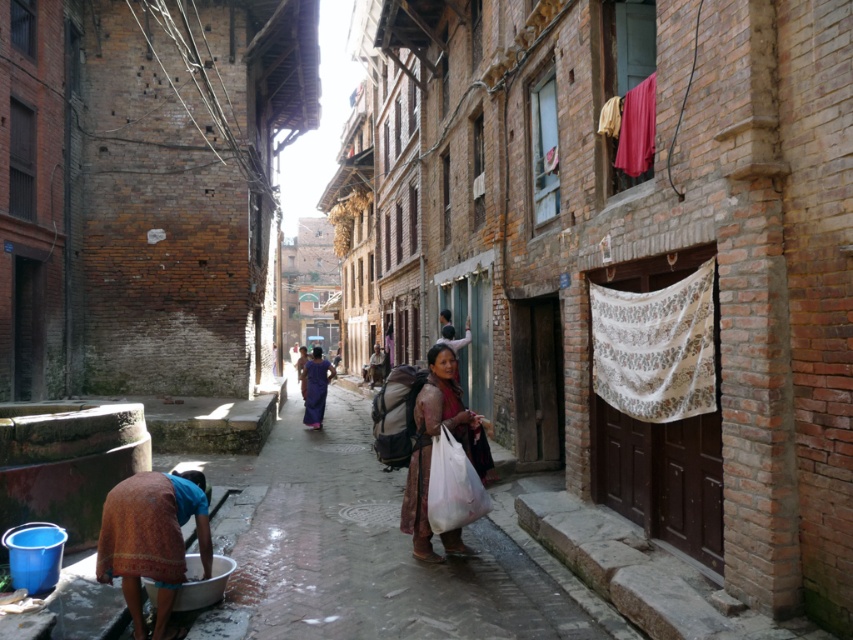
What do you see at coordinates (152, 540) in the screenshot? This screenshot has width=853, height=640. I see `brown woven cloth at lower left` at bounding box center [152, 540].

Is brown woven cloth at lower left positioned in front of matte purple sari at center?

Yes, it is.

Describe the element at coordinates (152, 540) in the screenshot. I see `brown woven cloth at lower left` at that location.

Where is `brown woven cloth at lower left`? This screenshot has height=640, width=853. brown woven cloth at lower left is located at coordinates (152, 540).

Between brown woven cloth at lower left and brown textured shawl at center, which one is positioned lower?

Positioned lower is brown woven cloth at lower left.

Between point (132, 516) and point (426, 536), which one is positioned in front?

Point (132, 516) is in front.

Measure the distance between point (105, 509) and camera.

Point (105, 509) and camera are 4.52 meters apart.

Locate an element on the screen. The height and width of the screenshot is (640, 853). brown woven cloth at lower left is located at coordinates tap(152, 540).

Between brown textured shawl at center and matte purple sari at center, which one is positioned higher?

brown textured shawl at center

What do you see at coordinates (431, 444) in the screenshot? This screenshot has width=853, height=640. I see `brown textured shawl at center` at bounding box center [431, 444].

Does point (438, 355) come farther from viewer compared to point (320, 378)?

No, (438, 355) is closer to viewer.

Where is `brown textured shawl at center`? The image size is (853, 640). brown textured shawl at center is located at coordinates (431, 444).